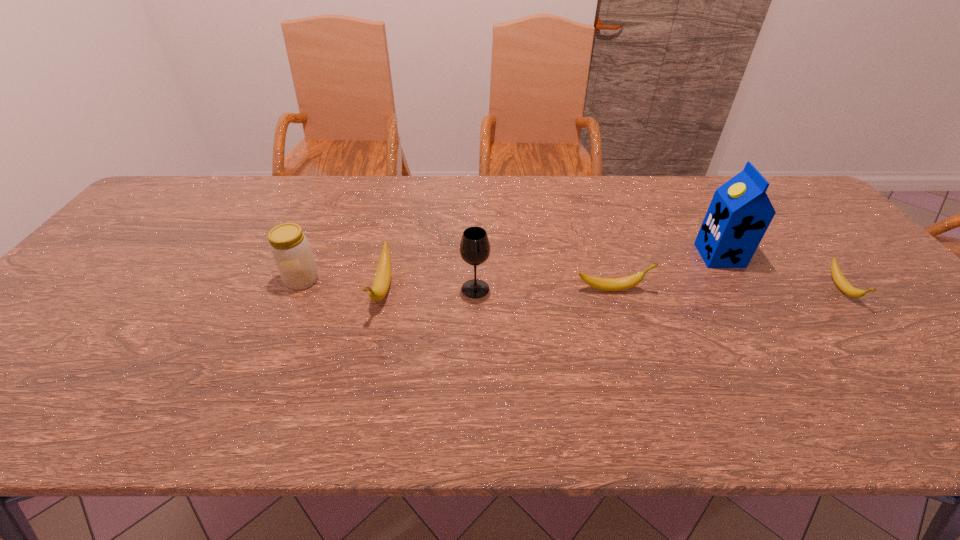
Identify the location of vacant space at the near edge. (793, 358).

Locate an element on the screen. Image resolution: width=960 pixels, height=540 pixels. vacant space at the left edge of the desktop is located at coordinates (165, 237).

Where is `vacant space at the far right corner of the desktop`? This screenshot has height=540, width=960. vacant space at the far right corner of the desktop is located at coordinates (783, 188).

I want to click on empty space between the second object from left to right and the second tallest banana, so (497, 289).

I want to click on free space between the third object from right to left and the carton, so click(665, 272).

The image size is (960, 540). In order to click on blank region between the tallest object and the jar in this screenshot , I will do `click(511, 268)`.

Where is `vacant space that's between the jar and the tallest object`? The image size is (960, 540). vacant space that's between the jar and the tallest object is located at coordinates (511, 268).

Where is `free space between the leftmost object and the second object from left to right`? free space between the leftmost object and the second object from left to right is located at coordinates (343, 285).

The width and height of the screenshot is (960, 540). I want to click on empty space that is in between the rightmost object and the wineglass, so click(x=659, y=289).

I want to click on empty location between the wineglass and the carton, so click(x=597, y=272).